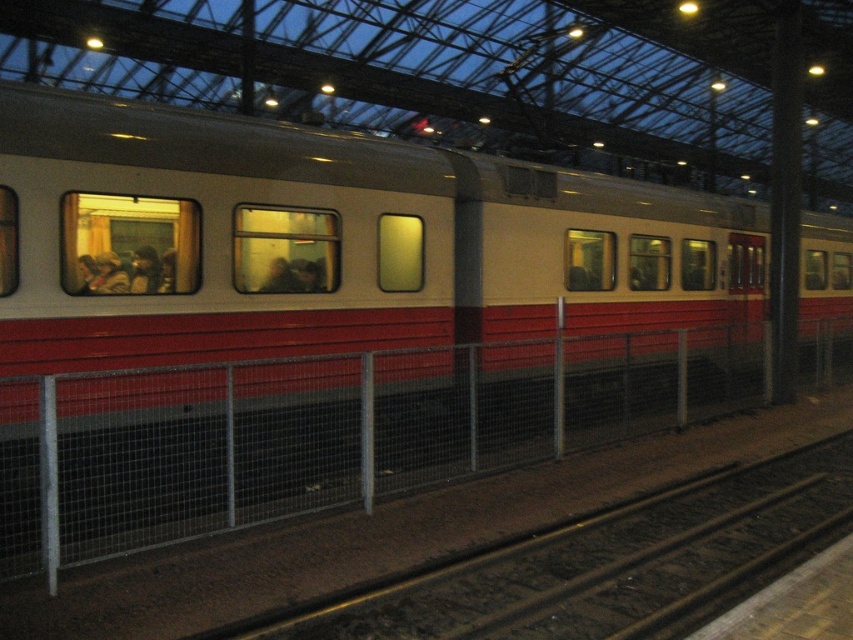
The image size is (853, 640). Identify the location of smooth metal train track at lower center. (602, 563).

Is point (577, 637) positioned after point (102, 278)?

No, (577, 637) is in front of (102, 278).

The width and height of the screenshot is (853, 640). Find the location of `smooth metal train track at lower center`. smooth metal train track at lower center is located at coordinates (602, 563).

In order to click on smooth metal train track at lower center in this screenshot , I will do `click(602, 563)`.

In the scene shown: Which is more to the right, smooth metal train track at lower center or smooth glass window at center?

Positioned to the right is smooth metal train track at lower center.

Is point (457, 609) positioned after point (296, 260)?

No, (457, 609) is in front of (296, 260).

Find the location of a particular element. The height and width of the screenshot is (640, 853). smooth metal train track at lower center is located at coordinates (602, 563).

Is point (67, 563) positioned behind point (287, 276)?

No, (67, 563) is closer to viewer.

You are a GUI agent. You are given a task and a screenshot of the screen. Output one action in this format:
    pyautogui.click(x=<x>, y=<y>)
    Task: Click on the metal at center
    Image resolution: width=853 pixels, height=640 pixels.
    Given the screenshot: What is the action you would take?
    pyautogui.click(x=329, y=432)